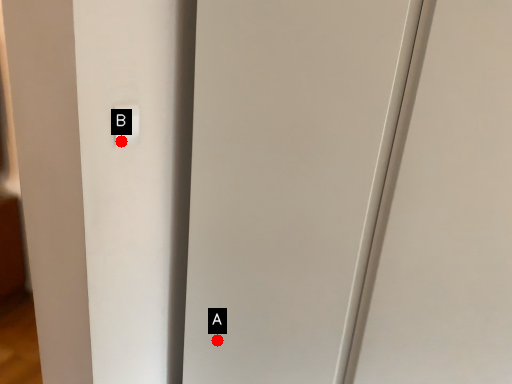
Question: Two points are circled on the image, labeled by A and B beside each circle. Which point appears farthest from the camera in this image?

Choices:
 (A) A is further
 (B) B is further

Answer: (A)